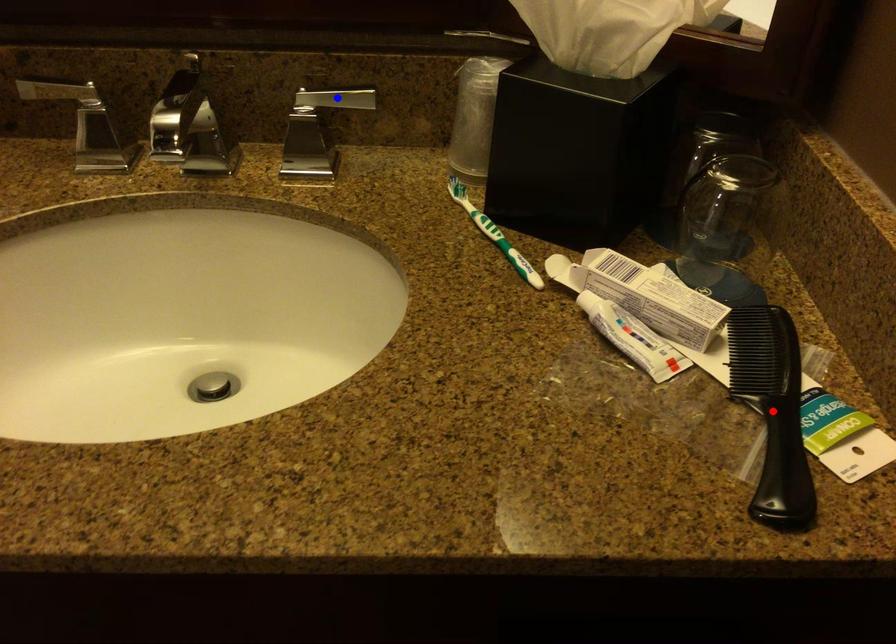
Question: Two points are marked on the image. Which point is closer to the camera?

Choices:
 (A) Blue point is closer.
 (B) Red point is closer.

Answer: (B)